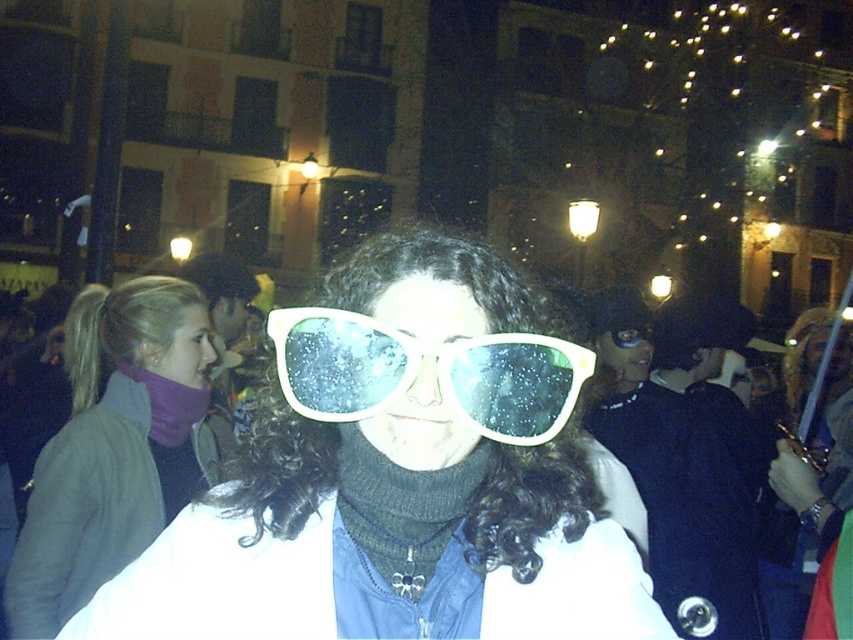
Question: Considering the relative positions of matte purple scarf at upper left and white plastic goggles at center in the image provided, where is matte purple scarf at upper left located with respect to white plastic goggles at center?

Choices:
 (A) above
 (B) below

Answer: (B)

Question: Which point is farther to the camera?

Choices:
 (A) (152, 528)
 (B) (282, 419)

Answer: (A)

Question: Considering the real-world distances, which object is farthest from the matte purple scarf at upper left?

Choices:
 (A) white plastic goggles at center
 (B) white plastic sunglasses at center

Answer: (A)

Question: Does white plastic sunglasses at center appear over white plastic goggles at center?

Choices:
 (A) yes
 (B) no

Answer: (B)

Question: Can you confirm if white plastic sunglasses at center is wider than white plastic goggles at center?

Choices:
 (A) no
 (B) yes

Answer: (B)

Question: Which point is farther to the camera?

Choices:
 (A) matte purple scarf at upper left
 (B) white plastic goggles at center
 (C) white plastic sunglasses at center

Answer: (A)